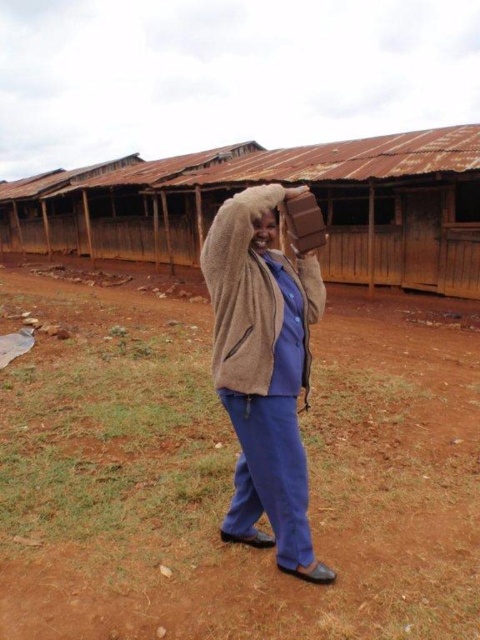
Question: Is the position of fuzzy brown sweater at center less distant than that of brown fuzzy hat at center?

Choices:
 (A) yes
 (B) no

Answer: (A)

Question: Which point is closer to the camera taking this photo?

Choices:
 (A) (55, 353)
 (B) (238, 276)

Answer: (B)

Question: Is brown dirt field at center wider than brown fuzzy hat at center?

Choices:
 (A) no
 (B) yes

Answer: (B)

Question: Observing the image, what is the correct spatial positioning of brown dirt field at center in reference to fuzzy brown sweater at center?

Choices:
 (A) right
 (B) left

Answer: (B)

Question: Based on their relative distances, which object is nearer to the brown dirt field at center?

Choices:
 (A) fuzzy brown sweater at center
 (B) brown fuzzy hat at center

Answer: (A)

Question: Based on their relative distances, which object is farther from the brown fuzzy hat at center?

Choices:
 (A) brown dirt field at center
 (B) fuzzy brown sweater at center

Answer: (A)